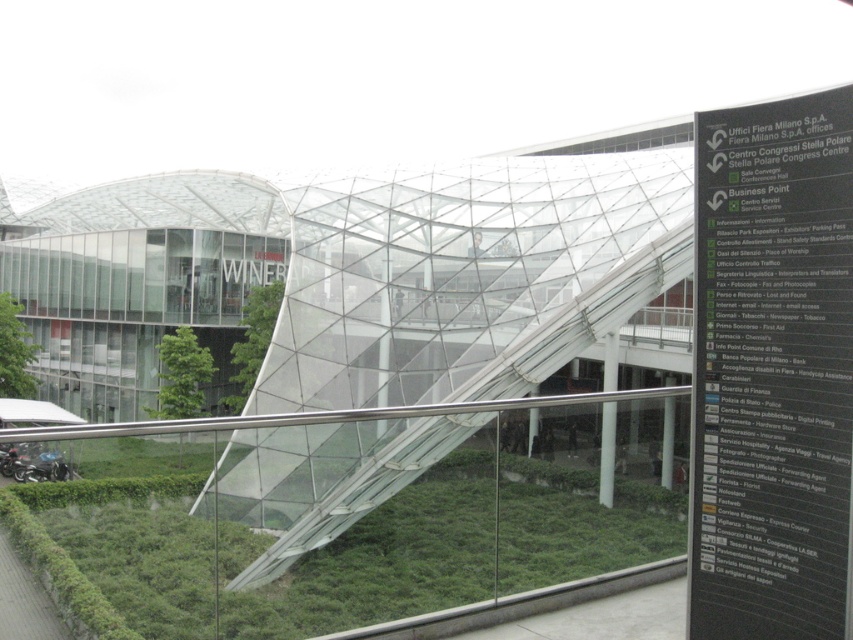
Question: Can you confirm if black plastic sign at right is smaller than green leafy tree at lower left?

Choices:
 (A) yes
 (B) no

Answer: (B)

Question: Which object is positioned closest to the green leafy grass at lower center?

Choices:
 (A) black plastic sign at right
 (B) green leafy tree at lower left

Answer: (A)

Question: Which point appears farthest from the camera in this image?

Choices:
 (A) (91, 627)
 (B) (235, 378)
 (C) (788, 131)

Answer: (B)

Question: From the image, what is the correct spatial relationship of black plastic sign at right in relation to green leafy grass at lower center?

Choices:
 (A) left
 (B) right

Answer: (B)

Question: Which point is closer to the camera?

Choices:
 (A) (750, 330)
 (B) (241, 342)
 (C) (445, 525)

Answer: (A)

Question: Does green leafy grass at lower center have a greater width compared to green leafy vegetation at center?

Choices:
 (A) yes
 (B) no

Answer: (B)